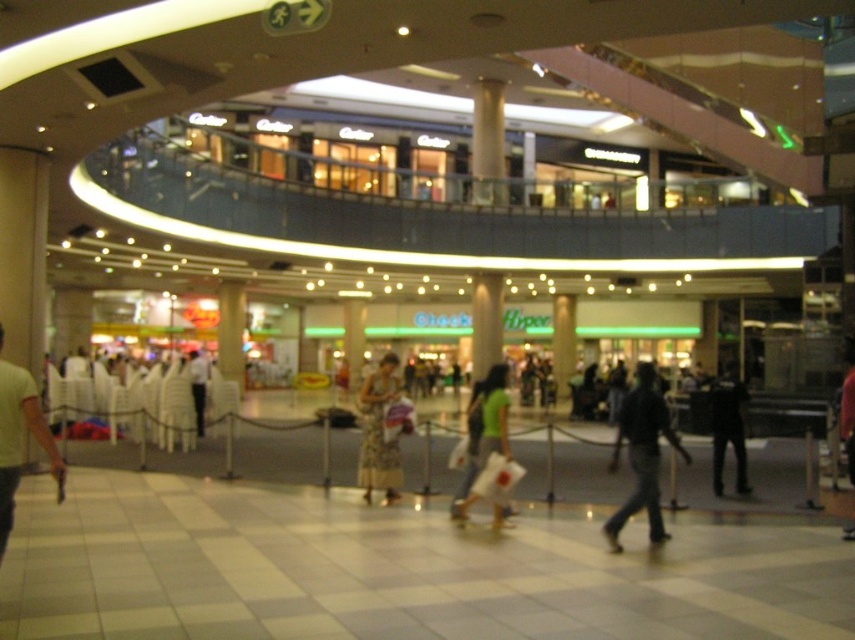
Question: Is green matte shirt at center closer to the viewer compared to floral dress at center?

Choices:
 (A) yes
 (B) no

Answer: (A)

Question: Which point appears closest to the camera in this image?

Choices:
 (A) (490, 452)
 (B) (653, 428)
 (C) (390, 403)

Answer: (B)

Question: From the image, what is the correct spatial relationship of dark blue jeans at center in relation to black matte pants at lower right?

Choices:
 (A) above
 (B) below

Answer: (B)

Question: Is green cotton shirt at center further to camera compared to light brown fabric dress at center?

Choices:
 (A) no
 (B) yes

Answer: (A)

Question: Which of the following is the closest to the observer?

Choices:
 (A) green matte shirt at center
 (B) dark blue jeans at center
 (C) black matte pants at lower right
 (D) light brown fabric dress at center

Answer: (A)

Question: Among these objects, which one is farthest from the camera?

Choices:
 (A) dark blue jeans at center
 (B) black matte pants at lower right
 (C) green cotton shirt at center

Answer: (B)